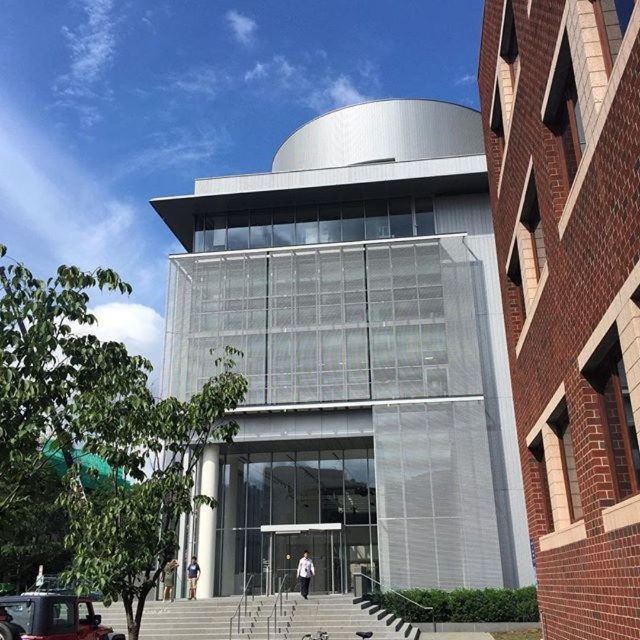
Question: Which object appears farthest from the camera in this image?

Choices:
 (A) matte black car at lower left
 (B) clear glass door at center
 (C) white matte jacket at center

Answer: (B)

Question: Considering the real-world distances, which object is closest to the gray concrete stairs at center?

Choices:
 (A) matte black car at lower left
 (B) white matte jacket at center
 (C) light brown leather jacket at lower center

Answer: (C)

Question: Which object appears farthest from the camera in this image?

Choices:
 (A) white fabric shirt at center
 (B) white matte jacket at center
 (C) matte black car at lower left
 (D) light brown leather jacket at lower center

Answer: (D)

Question: Does clear glass door at center have a lesser width compared to light brown leather jacket at lower center?

Choices:
 (A) no
 (B) yes

Answer: (A)

Question: Can you confirm if matte black car at lower left is wider than clear glass door at center?

Choices:
 (A) no
 (B) yes

Answer: (B)

Question: Is gray concrete stairs at center positioned in front of clear glass door at center?

Choices:
 (A) no
 (B) yes

Answer: (B)